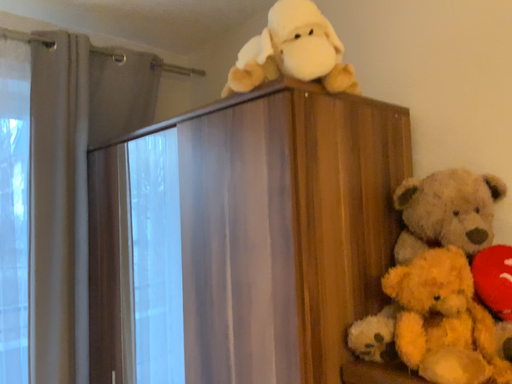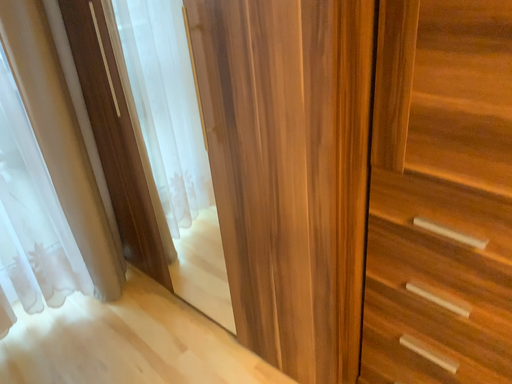
Question: How did the camera likely rotate when shooting the video?

Choices:
 (A) rotated upward
 (B) rotated downward

Answer: (B)